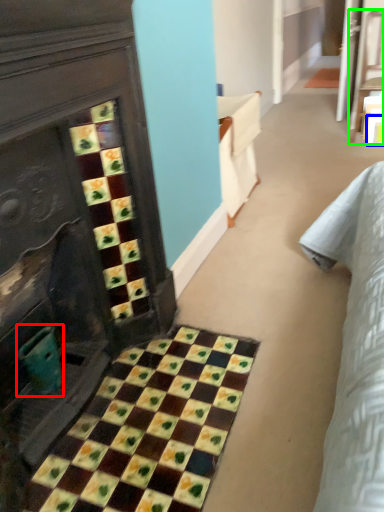
Question: Which object is the farthest from teal (highlighted by a red box)? Choose among these: square (highlighted by a blue box) or furniture (highlighted by a green box).

Choices:
 (A) square
 (B) furniture

Answer: (B)